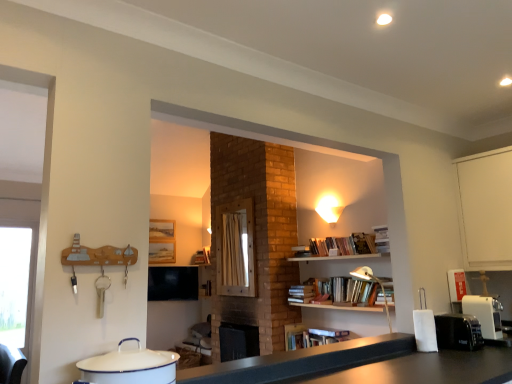
Question: Should I look upward or downward to see matte white lampshade at upper center?

Choices:
 (A) down
 (B) up

Answer: (A)

Question: Considering the relative positions of black plastic toaster at right, which appears as the first appliance when viewed from the right, and white plastic coffee machine at lower right in the image provided, is black plastic toaster at right, which appears as the first appliance when viewed from the right, to the left of white plastic coffee machine at lower right from the viewer's perspective?

Choices:
 (A) no
 (B) yes

Answer: (B)

Question: Is black plastic toaster at right, the 2th appliance viewed from the top, not inside white plastic coffee machine at lower right?

Choices:
 (A) yes
 (B) no

Answer: (A)

Question: Is black plastic toaster at right, acting as the 2th appliance starting from the left, facing away from white plastic coffee machine at lower right?

Choices:
 (A) yes
 (B) no

Answer: (B)

Question: Considering the relative sizes of black plastic toaster at right, positioned as the 1th appliance in bottom-to-top order, and white plastic coffee machine at lower right in the image provided, is black plastic toaster at right, positioned as the 1th appliance in bottom-to-top order, taller than white plastic coffee machine at lower right?

Choices:
 (A) yes
 (B) no

Answer: (B)

Question: Is the depth of black plastic toaster at right, the 2th appliance viewed from the top, greater than that of white plastic coffee machine at lower right?

Choices:
 (A) yes
 (B) no

Answer: (B)

Question: Is wooden frame at center turned away from matte white lampshade at upper center?

Choices:
 (A) no
 (B) yes

Answer: (A)

Question: Considering the relative positions of wooden frame at center and matte white lampshade at upper center in the image provided, is wooden frame at center behind matte white lampshade at upper center?

Choices:
 (A) yes
 (B) no

Answer: (A)

Question: Is wooden frame at center bigger than matte white lampshade at upper center?

Choices:
 (A) no
 (B) yes

Answer: (B)

Question: Can you confirm if wooden frame at center is wider than matte white lampshade at upper center?

Choices:
 (A) no
 (B) yes

Answer: (A)

Question: Is matte white lampshade at upper center surrounded by wooden frame at center?

Choices:
 (A) no
 (B) yes

Answer: (A)

Question: Is wooden frame at center located outside matte white lampshade at upper center?

Choices:
 (A) yes
 (B) no

Answer: (A)

Question: From the image's perspective, does metallic silver lamp at upper right appear higher than black matte counter top at center?

Choices:
 (A) yes
 (B) no

Answer: (A)